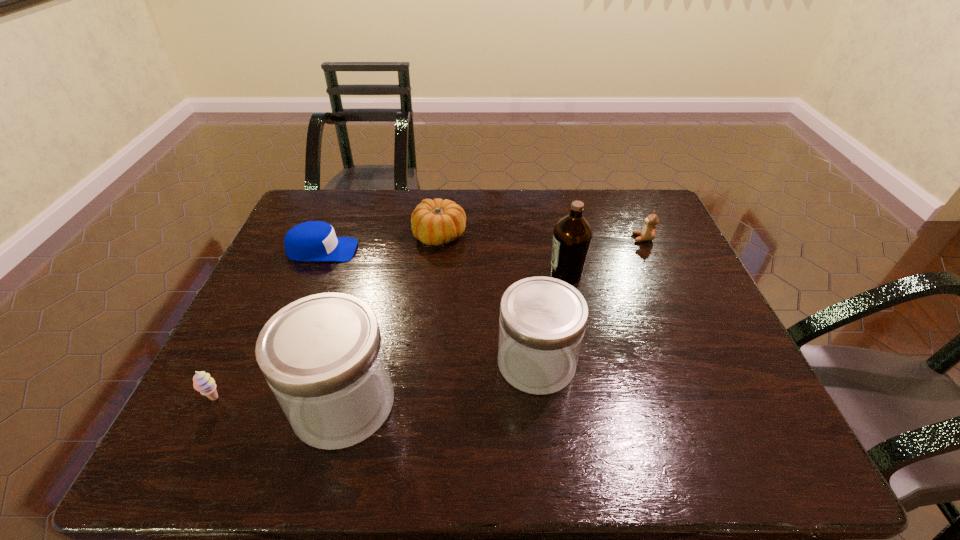
In the image, there is a desktop. Identify the location of free space at the right edge. This screenshot has height=540, width=960. [662, 302].

Identify the location of vacant area at the near right corner. Image resolution: width=960 pixels, height=540 pixels. (728, 388).

Locate an element on the screen. free space between the baseball cap and the teddy bear is located at coordinates (483, 244).

The image size is (960, 540). I want to click on free point between the baseball cap and the gourd, so click(x=380, y=243).

The image size is (960, 540). I want to click on vacant region between the teddy bear and the sherbert, so click(x=429, y=319).

Identify the location of unoccupied area between the rightmost object and the gourd. (541, 237).

This screenshot has width=960, height=540. I want to click on free space between the olive oil and the sherbert, so click(x=391, y=336).

Locate an element on the screen. vacant space that's between the left jar and the olive oil is located at coordinates (455, 339).

Locate an element on the screen. The width and height of the screenshot is (960, 540). vacant area that lies between the baseball cap and the olive oil is located at coordinates (444, 262).

The height and width of the screenshot is (540, 960). In order to click on free area in between the third tallest object and the baseball cap in this screenshot , I will do `click(429, 306)`.